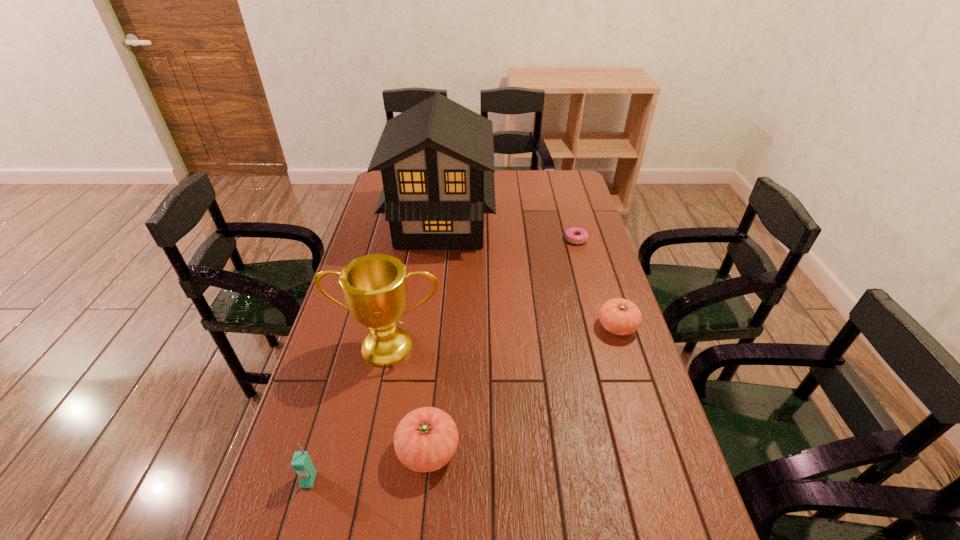
You are a GUI agent. You are given a task and a screenshot of the screen. Output one action in this format:
    pyautogui.click(x=<x>, y=<y>)
    Task: Click on the free space at the near edge
    The width and height of the screenshot is (960, 540).
    Given the screenshot: What is the action you would take?
    pyautogui.click(x=446, y=530)

Image resolution: width=960 pixels, height=540 pixels. What are the coordinates of `blank space at the left edge` in the screenshot? It's located at (302, 428).

Image resolution: width=960 pixels, height=540 pixels. In the image, there is a desktop. Find the location of `free space at the right edge`. free space at the right edge is located at coordinates (568, 245).

Locate an element on the screen. vacant space in between the taller tomato and the award is located at coordinates (409, 399).

Identify the location of vacant space that's between the award and the nearer tomato. (409, 399).

Find the location of a particular element. The height and width of the screenshot is (540, 960). vacant space that's between the shorter tomato and the cellular telephone is located at coordinates (463, 403).

Where is `empty location between the second tallest object and the left tomato`? The width and height of the screenshot is (960, 540). empty location between the second tallest object and the left tomato is located at coordinates (409, 399).

Locate an element on the screen. Image resolution: width=960 pixels, height=540 pixels. free spot between the fifth shortest object and the fifth tallest object is located at coordinates point(503,337).

At what (x,y) coordinates should I click in order to perform the action: click on vacant area that lies between the shortest object and the tallest object. Please return your answer as a coordinate pair (x, y). Looking at the image, I should click on (508, 232).

Identify the location of free space between the fourth shortest object and the shorter tomato. The height and width of the screenshot is (540, 960). (463, 403).